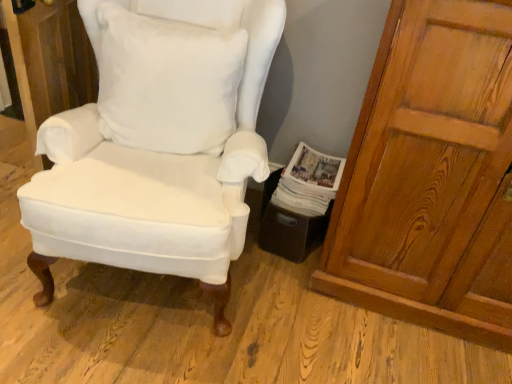
The height and width of the screenshot is (384, 512). Describe the element at coordinates (430, 174) in the screenshot. I see `wooden door at right` at that location.

This screenshot has width=512, height=384. Identify the location of white paper magazine at lower right. (309, 181).

Image resolution: width=512 pixels, height=384 pixels. I want to click on white cotton pillow at center, so pos(167,82).

Considering the sizes of white cotton pillow at center and matte white cushioned chair at center in the image, is white cotton pillow at center wider or thinner than matte white cushioned chair at center?

white cotton pillow at center is thinner than matte white cushioned chair at center.

Can you confirm if white cotton pillow at center is smaller than matte white cushioned chair at center?

Yes.

Does point (150, 42) appear closer or farther from the camera than point (28, 207)?

Point (150, 42) is positioned farther from the camera compared to point (28, 207).

From a real-world perspective, which is physically below, white paper magazine at lower right or white cotton pillow at center?

white paper magazine at lower right is physically lower.

Does point (323, 206) come in front of point (119, 31)?

That is False.

Does white paper magazine at lower right have a lesser width compared to white cotton pillow at center?

Incorrect, the width of white paper magazine at lower right is not less than that of white cotton pillow at center.

Which is more to the right, white paper magazine at lower right or white cotton pillow at center?

white paper magazine at lower right.

From the image's perspective, between white paper magazine at lower right and matte white cushioned chair at center, which one is located above?

matte white cushioned chair at center is shown above in the image.

In terms of height, does white paper magazine at lower right look taller or shorter compared to matte white cushioned chair at center?

In the image, white paper magazine at lower right appears to be shorter than matte white cushioned chair at center.

Where is `chair above the white paper magazine at lower right (from a real-world perspective)`? The height and width of the screenshot is (384, 512). chair above the white paper magazine at lower right (from a real-world perspective) is located at coordinates (158, 143).

Considering the points (286, 192) and (72, 258), which point is behind, point (286, 192) or point (72, 258)?

Point (286, 192)

Considering the relative positions of matte white cushioned chair at center and white paper magazine at lower right in the image provided, is matte white cushioned chair at center behind white paper magazine at lower right?

That is False.

How much distance is there between matte white cushioned chair at center and white paper magazine at lower right?

A distance of 21.54 inches exists between matte white cushioned chair at center and white paper magazine at lower right.

Is matte white cushioned chair at center facing towards white paper magazine at lower right?

No, matte white cushioned chair at center is not facing towards white paper magazine at lower right.

You are a GUI agent. You are given a task and a screenshot of the screen. Output one action in this format:
    pyautogui.click(x=<x>, y=<y>)
    Task: Click on the magazine on the right of matte white cushioned chair at center
    The image size is (512, 384).
    Given the screenshot: What is the action you would take?
    pyautogui.click(x=309, y=181)

From a real-world perspective, which object stands above the other?

From a 3D spatial view, wooden door at right is above.

Is wooden door at right to the left or to the right of white paper magazine at lower right in the image?

From the image, it's evident that wooden door at right is to the right of white paper magazine at lower right.

Could you tell me if wooden door at right is turned towards white paper magazine at lower right?

No, wooden door at right does not turn towards white paper magazine at lower right.

Does wooden door at right lie in front of white paper magazine at lower right?

Yes.

From a real-world perspective, who is located lower, white paper magazine at lower right or wooden door at right?

white paper magazine at lower right.

How different are the orientations of white paper magazine at lower right and wooden door at right in degrees?

They differ by 0.000246 degrees in their facing directions.

Does point (325, 185) lie behind point (402, 273)?

Yes, point (325, 185) is farther from viewer.

Is white paper magazine at lower right not near wooden door at right?

white paper magazine at lower right is near wooden door at right, not far away.

Looking at this image, which of these two, white cotton pillow at center or white paper magazine at lower right, is bigger?

white cotton pillow at center.

From the image's perspective, is white cotton pillow at center located above white paper magazine at lower right?

Yes, from the image's perspective, white cotton pillow at center is above white paper magazine at lower right.

Is white cotton pillow at center taller or shorter than white paper magazine at lower right?

white cotton pillow at center is taller than white paper magazine at lower right.

How many degrees apart are the facing directions of white cotton pillow at center and white paper magazine at lower right?

white cotton pillow at center and white paper magazine at lower right are facing 11.4 degrees away from each other.

Where is `chair on the left of the white cotton pillow at center`? The width and height of the screenshot is (512, 384). chair on the left of the white cotton pillow at center is located at coordinates (158, 143).

Find the location of a particular element. The image size is (512, 384). magazine that is under the white cotton pillow at center (from a real-world perspective) is located at coordinates (309, 181).

From the image, which object appears to be nearer to white cotton pillow at center, matte white cushioned chair at center or wooden door at right?

The object closer to white cotton pillow at center is matte white cushioned chair at center.

Based on the photo, from the image, which object appears to be farther from matte white cushioned chair at center, white cotton pillow at center or wooden door at right?

wooden door at right is positioned further to the anchor matte white cushioned chair at center.

Based on their spatial positions, is white cotton pillow at center or wooden door at right closer to white paper magazine at lower right?

→ wooden door at right is positioned closer to the anchor white paper magazine at lower right.

Which object lies further to the anchor point white cotton pillow at center, wooden door at right or white paper magazine at lower right?

wooden door at right is positioned further to the anchor white cotton pillow at center.

Estimate the real-world distances between objects in this image. Which object is closer to matte white cushioned chair at center, white paper magazine at lower right or white cotton pillow at center?

white cotton pillow at center is closer to matte white cushioned chair at center.

Looking at the image, which one is located closer to white paper magazine at lower right, matte white cushioned chair at center or white cotton pillow at center?

white cotton pillow at center is positioned closer to the anchor white paper magazine at lower right.

From the picture: Which object lies further to the anchor point wooden door at right, matte white cushioned chair at center or white paper magazine at lower right?

Among the two, matte white cushioned chair at center is located further to wooden door at right.

From the image, which object appears to be farther from matte white cushioned chair at center, wooden door at right or white paper magazine at lower right?

The object further to matte white cushioned chair at center is wooden door at right.

Find the location of a particular element. magazine between white cotton pillow at center and wooden door at right is located at coordinates (309, 181).

Where is `pillow situated between matte white cushioned chair at center and wooden door at right from left to right`? pillow situated between matte white cushioned chair at center and wooden door at right from left to right is located at coordinates (167, 82).

The image size is (512, 384). What are the coordinates of `magazine located between matte white cushioned chair at center and wooden door at right in the left-right direction` in the screenshot? It's located at (309, 181).

You are a GUI agent. You are given a task and a screenshot of the screen. Output one action in this format:
    pyautogui.click(x=<x>, y=<y>)
    Task: Click on the pillow positioned between matte white cushioned chair at center and white paper magazine at lower right from near to far
    This screenshot has width=512, height=384.
    Given the screenshot: What is the action you would take?
    pyautogui.click(x=167, y=82)